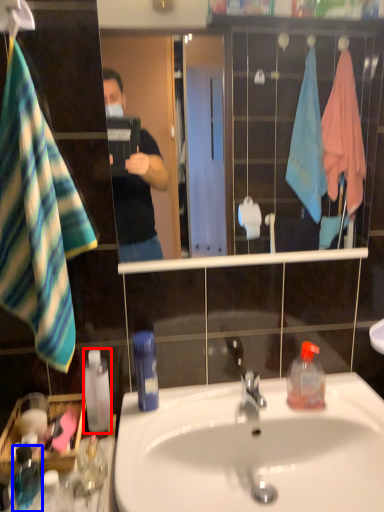
Question: Which point is further to the camera, bottle (highlighted by a red box) or bottle (highlighted by a blue box)?

Choices:
 (A) bottle
 (B) bottle

Answer: (A)